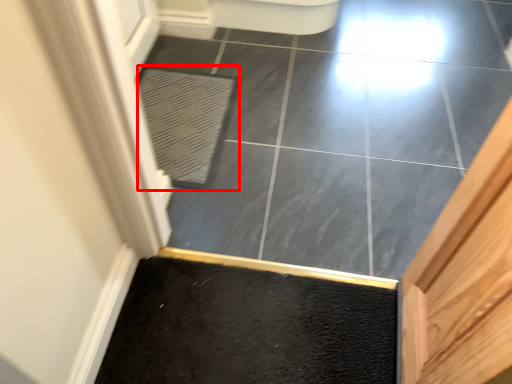
Question: From the image's perspective, what is the correct spatial positioning of bath mat (annotated by the red box) in reference to ceramic tile?

Choices:
 (A) above
 (B) below

Answer: (B)